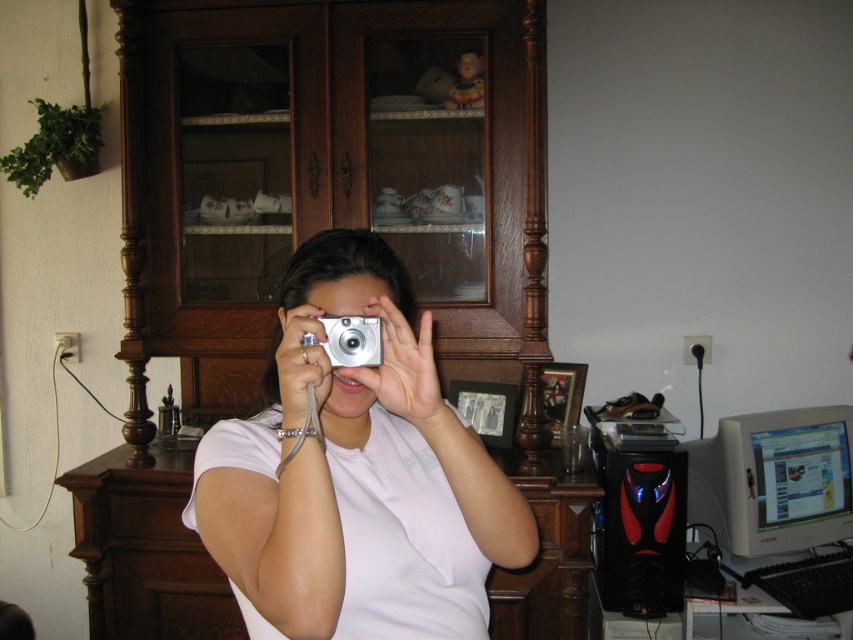
How far apart are black plastic monitor at right and silver metallic camera at center?

A distance of 4.88 feet exists between black plastic monitor at right and silver metallic camera at center.

This screenshot has height=640, width=853. I want to click on black plastic monitor at right, so click(775, 481).

This screenshot has height=640, width=853. What are the coordinates of `black plastic monitor at right` in the screenshot? It's located at pyautogui.click(x=775, y=481).

This screenshot has height=640, width=853. What are the coordinates of `black plastic monitor at right` in the screenshot? It's located at (775, 481).

Is matte silver camera at center bigger than black plastic monitor at right?

Correct, matte silver camera at center is larger in size than black plastic monitor at right.

Is point (492, 481) behind point (838, 477)?

No, it is not.

Where is `matte silver camera at center`? matte silver camera at center is located at coordinates (357, 476).

From the picture: Who is lower down, matte silver camera at center or silver metallic camera at center?

Positioned lower is matte silver camera at center.

Does matte silver camera at center appear on the left side of silver metallic camera at center?

No, matte silver camera at center is not to the left of silver metallic camera at center.

Where is `matte silver camera at center`? matte silver camera at center is located at coordinates (357, 476).

This screenshot has height=640, width=853. In order to click on matte silver camera at center in this screenshot , I will do `click(357, 476)`.